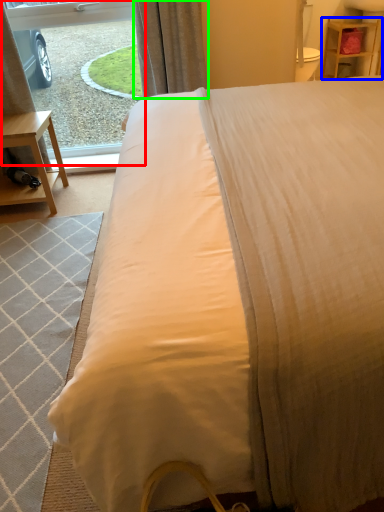
Question: Considering the real-world distances, which object is farthest from window screen (highlighted by a red box)? nightstand (highlighted by a blue box) or curtain (highlighted by a green box)?

Choices:
 (A) nightstand
 (B) curtain

Answer: (A)